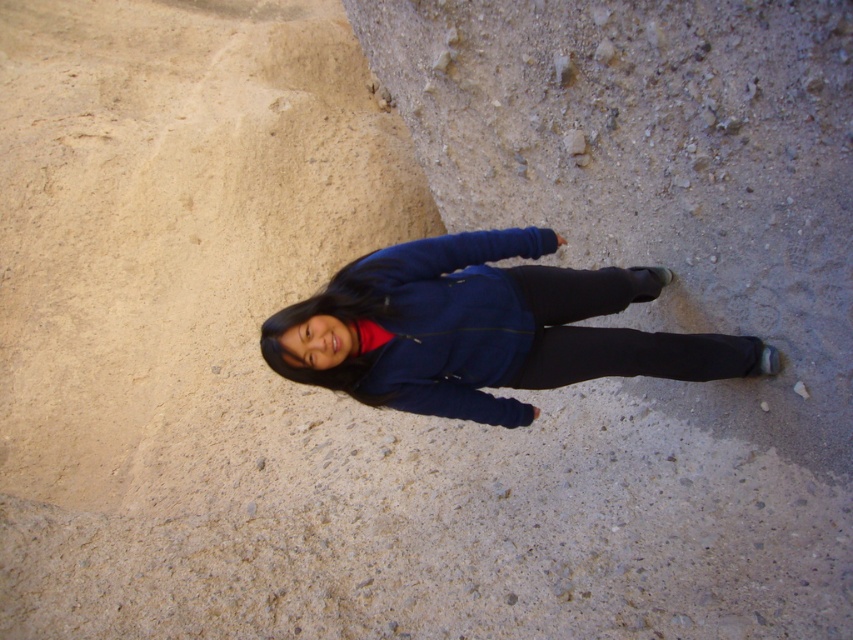
Question: Can you confirm if blue fabric jacket at center is positioned below matte blue sweatshirt at center?

Choices:
 (A) no
 (B) yes

Answer: (A)

Question: Which object is closer to the camera taking this photo?

Choices:
 (A) blue fabric jacket at center
 (B) matte blue sweatshirt at center

Answer: (A)

Question: Which of the following is the farthest from the observer?

Choices:
 (A) matte blue sweatshirt at center
 (B) blue fabric jacket at center

Answer: (A)

Question: Among these points, which one is nearest to the camera?

Choices:
 (A) pyautogui.click(x=459, y=356)
 (B) pyautogui.click(x=479, y=403)

Answer: (A)

Question: Can you confirm if blue fabric jacket at center is smaller than matte blue sweatshirt at center?

Choices:
 (A) yes
 (B) no

Answer: (B)

Question: Can you confirm if blue fabric jacket at center is smaller than matte blue sweatshirt at center?

Choices:
 (A) yes
 (B) no

Answer: (B)